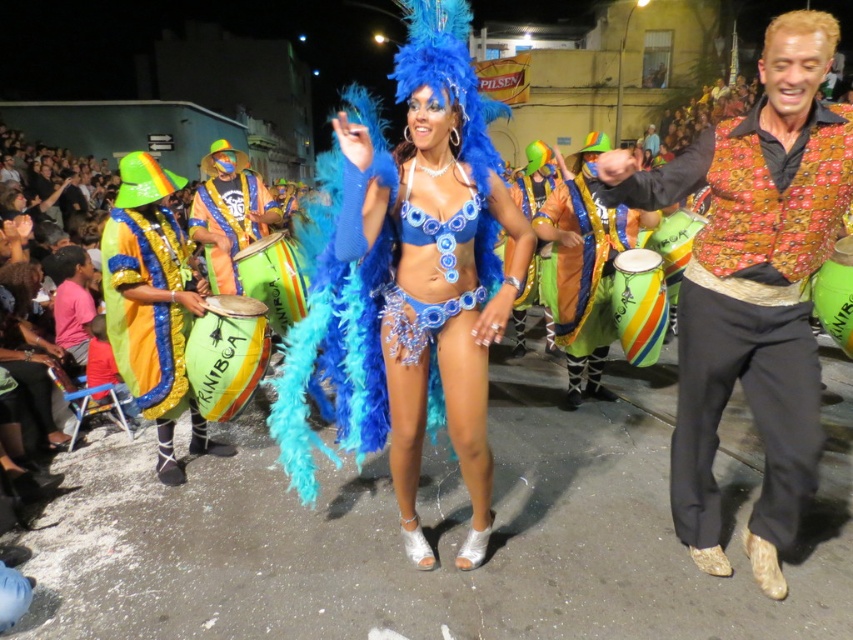
Question: Is multicolored fabric drum at right above green rubber drum at center?

Choices:
 (A) yes
 (B) no

Answer: (B)

Question: Does yellow-green sequined costume at left have a larger size compared to shiny metallic drum at center?

Choices:
 (A) yes
 (B) no

Answer: (B)

Question: Which point is closer to the camera?

Choices:
 (A) (387, 202)
 (B) (274, 284)
 (C) (216, 221)
 (D) (605, 292)

Answer: (A)

Question: Does shiny blue feathers at center come in front of green rubber drum at center?

Choices:
 (A) no
 (B) yes

Answer: (B)

Question: Which point is closer to the camera?

Choices:
 (A) (271, 316)
 (B) (816, 291)
 (C) (796, 422)
 (D) (125, 305)

Answer: (C)

Question: Which object is positioned closest to the green/yellow drum at center?

Choices:
 (A) floral-patterned vest at center
 (B) green rubber drum at center

Answer: (A)